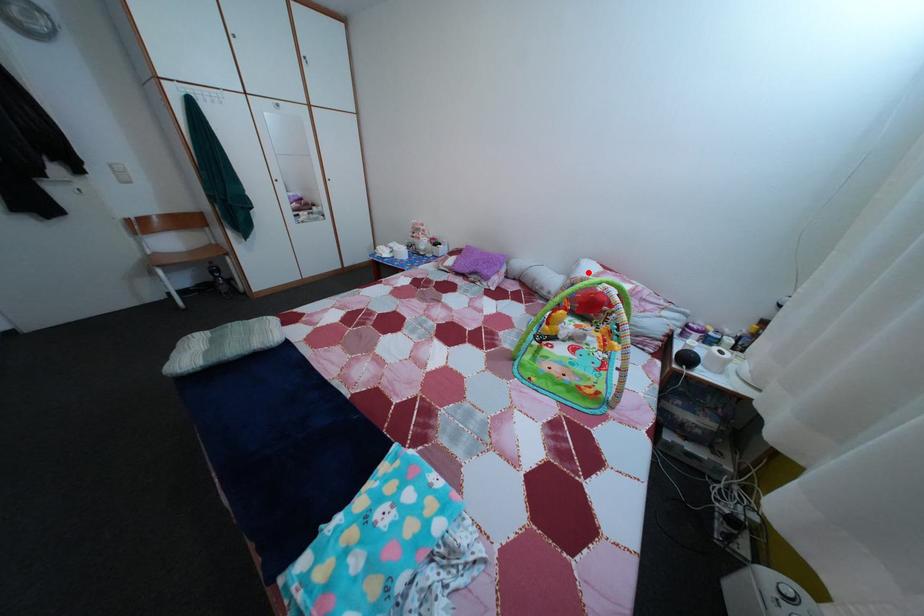
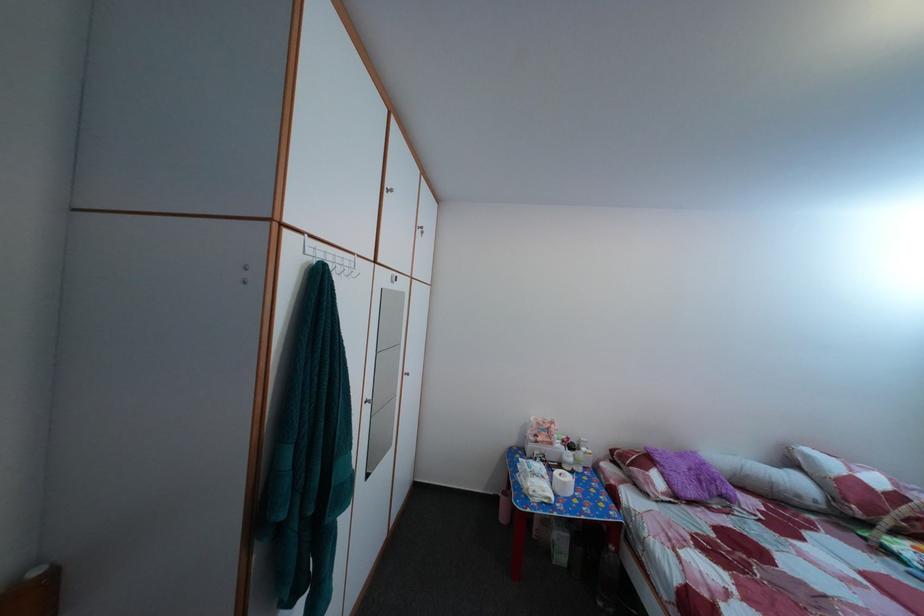
Where in the second image is the point corresponding to the highlighted location from the first image?

(817, 464)